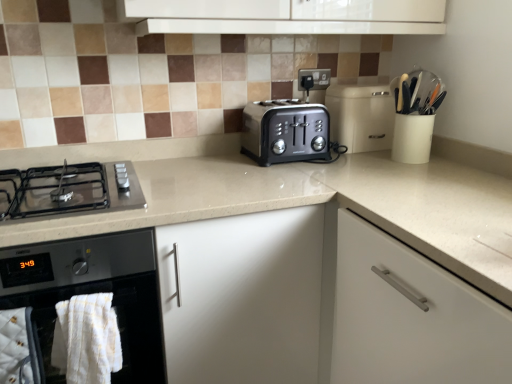
Question: Is beige glossy countertop at center thinner than black glass oven at lower left?

Choices:
 (A) no
 (B) yes

Answer: (B)

Question: Would you say beige glossy countertop at center contains black glass oven at lower left?

Choices:
 (A) no
 (B) yes

Answer: (B)

Question: From a real-world perspective, is beige glossy countertop at center located beneath black glass oven at lower left?

Choices:
 (A) no
 (B) yes

Answer: (B)

Question: Considering the relative sizes of beige glossy countertop at center and black glass oven at lower left in the image provided, is beige glossy countertop at center taller than black glass oven at lower left?

Choices:
 (A) no
 (B) yes

Answer: (B)

Question: Is beige glossy countertop at center oriented towards black glass oven at lower left?

Choices:
 (A) no
 (B) yes

Answer: (B)

Question: Considering the relative sizes of beige glossy countertop at center and black glass oven at lower left in the image provided, is beige glossy countertop at center smaller than black glass oven at lower left?

Choices:
 (A) yes
 (B) no

Answer: (B)

Question: Considering the relative positions of black glass oven at lower left and black matte gas stove at lower left in the image provided, is black glass oven at lower left to the right of black matte gas stove at lower left from the viewer's perspective?

Choices:
 (A) no
 (B) yes

Answer: (A)

Question: Is black matte gas stove at lower left located within black glass oven at lower left?

Choices:
 (A) yes
 (B) no

Answer: (B)

Question: Is black glass oven at lower left positioned in front of black matte gas stove at lower left?

Choices:
 (A) yes
 (B) no

Answer: (A)

Question: From a real-world perspective, does black glass oven at lower left sit lower than black matte gas stove at lower left?

Choices:
 (A) no
 (B) yes

Answer: (B)

Question: Is black glass oven at lower left facing away from black matte gas stove at lower left?

Choices:
 (A) yes
 (B) no

Answer: (B)

Question: From the image's perspective, is black glass oven at lower left over black matte gas stove at lower left?

Choices:
 (A) no
 (B) yes

Answer: (A)

Question: Does beige plastic bread bin at center have a greater height compared to black matte gas stove at lower left?

Choices:
 (A) no
 (B) yes

Answer: (B)